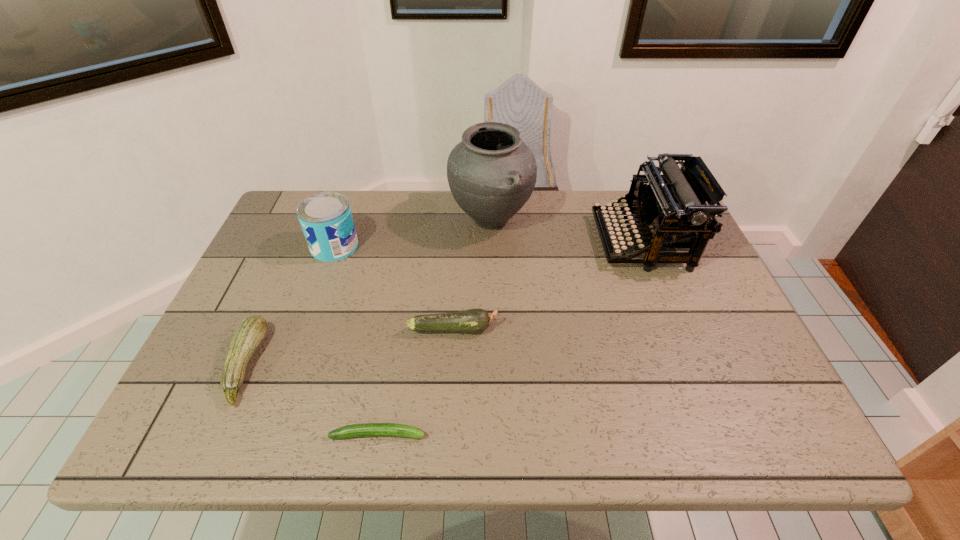
Locate an element on the screen. The image size is (960, 540). free space that satisfies the following two spatial constraints: 1. on the back side of the fourth shortest object; 2. on the right side of the tallest object is located at coordinates (344, 220).